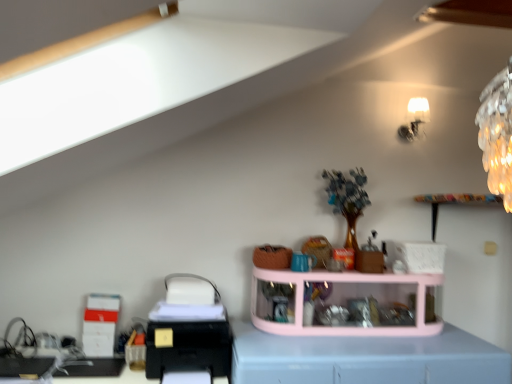
Question: Is black plastic printer at lower left wider than white glossy lampshade at upper right?

Choices:
 (A) yes
 (B) no

Answer: (A)

Question: Can you confirm if black plastic printer at lower left is bigger than white glossy lampshade at upper right?

Choices:
 (A) yes
 (B) no

Answer: (A)

Question: Does black plastic printer at lower left lie in front of white glossy lampshade at upper right?

Choices:
 (A) no
 (B) yes

Answer: (B)

Question: From the image's perspective, would you say black plastic printer at lower left is shown under white glossy lampshade at upper right?

Choices:
 (A) yes
 (B) no

Answer: (A)

Question: From the image's perspective, would you say black plastic printer at lower left is positioned over white glossy lampshade at upper right?

Choices:
 (A) no
 (B) yes

Answer: (A)

Question: Is black plastic printer at lower left at the right side of white glossy lampshade at upper right?

Choices:
 (A) no
 (B) yes

Answer: (A)

Question: From a real-world perspective, is light blue plastic at center on top of pink plastic shelf at center?

Choices:
 (A) no
 (B) yes

Answer: (A)

Question: Is light blue plastic at center facing away from pink plastic shelf at center?

Choices:
 (A) no
 (B) yes

Answer: (A)

Question: Can you confirm if light blue plastic at center is positioned to the left of pink plastic shelf at center?

Choices:
 (A) yes
 (B) no

Answer: (A)

Question: Would you say light blue plastic at center contains pink plastic shelf at center?

Choices:
 (A) no
 (B) yes

Answer: (A)

Question: Is light blue plastic at center not within pink plastic shelf at center?

Choices:
 (A) yes
 (B) no

Answer: (A)

Question: Is light blue plastic at center wider than pink plastic shelf at center?

Choices:
 (A) no
 (B) yes

Answer: (B)

Question: Is white glossy lampshade at upper right oriented away from light blue plastic at center?

Choices:
 (A) yes
 (B) no

Answer: (B)